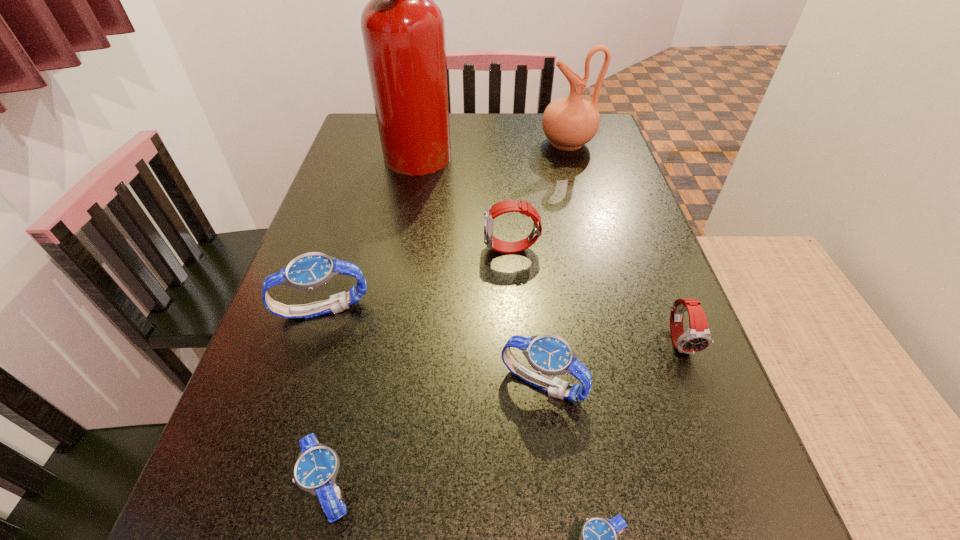
Image resolution: width=960 pixels, height=540 pixels. In order to click on red fire extinguisher in this screenshot , I will do `click(403, 30)`.

This screenshot has height=540, width=960. I want to click on fire extinguisher, so [x=403, y=30].

I want to click on pottery, so click(x=569, y=123).

I want to click on the farthest watch, so click(x=502, y=207).

Locate an element on the screen. This screenshot has width=960, height=540. the third farthest object is located at coordinates (502, 207).

Locate an element on the screen. the biggest blue watch is located at coordinates (308, 271).

The image size is (960, 540). In order to click on the second farthest blue watch in this screenshot , I will do `click(551, 355)`.

This screenshot has width=960, height=540. I want to click on the rightmost watch, so click(697, 338).

Locate an element on the screen. the right red watch is located at coordinates (697, 338).

Where is `the second smallest blue watch`? The image size is (960, 540). the second smallest blue watch is located at coordinates (315, 471).